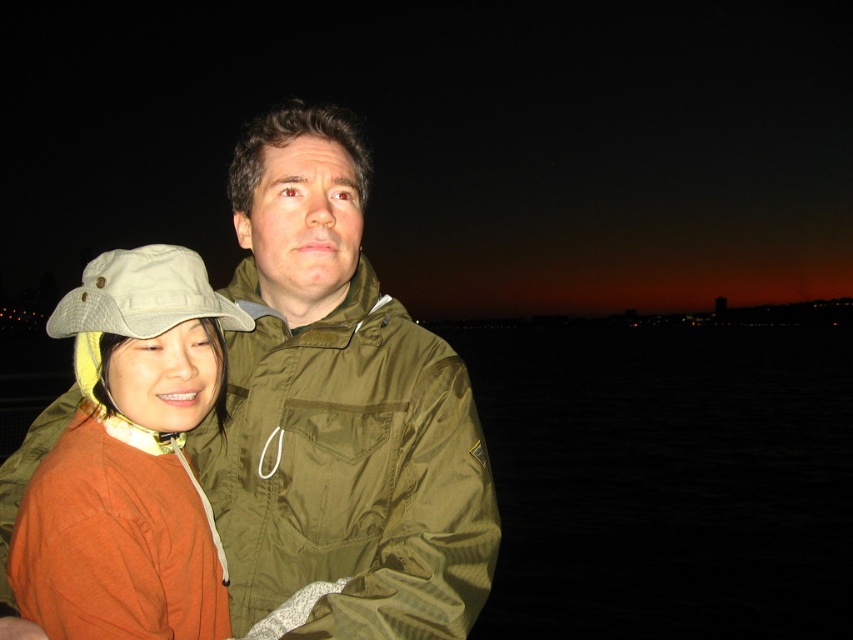
You are a photographer trying to capture a portrait of the two people in the image. The camera you are using has a focus point at coordinates 0.736, 0.410. Which person should you adjust the focus to ensure the olive green fabric jacket at center is in focus?

The olive green fabric jacket at center is positioned at point (349, 470), so adjusting the focus to that coordinate will ensure the olive green fabric jacket at center is in focus.

You are a fashion designer observing two jackets displayed side by side in the image. The orange matte jacket at center and the olive green fabric jacket at center are both on display. Which jacket would you recommend to a client who wants a larger size for a winter coat?

The orange matte jacket at center is bigger than the olive green fabric jacket at center, so it would be the better choice for someone seeking a larger winter coat size.